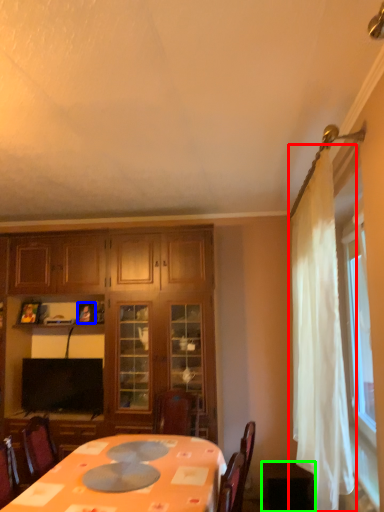
Question: Which object is the closest to the curtain (highlighted by a red box)? Choose among these: picture frame (highlighted by a blue box) or table (highlighted by a green box).

Choices:
 (A) picture frame
 (B) table

Answer: (B)